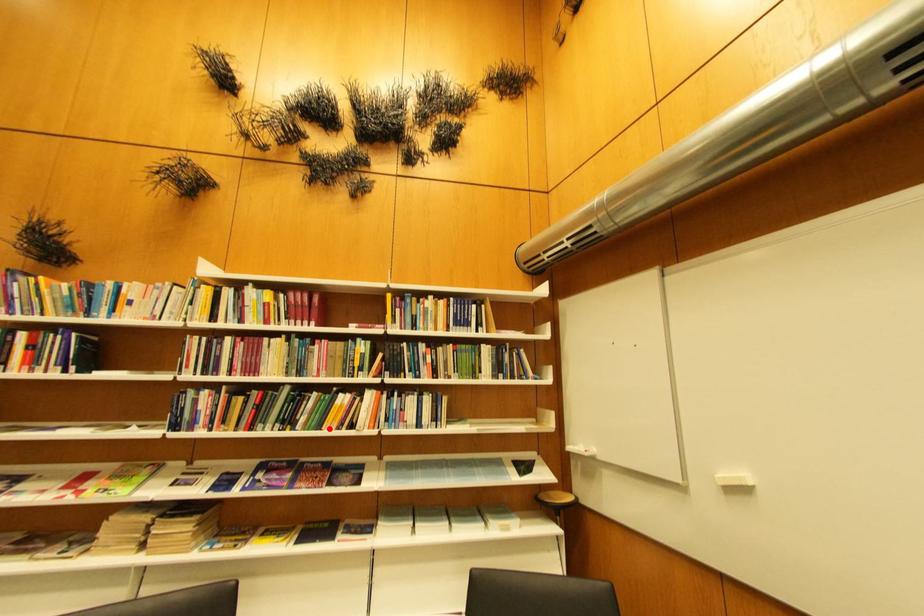
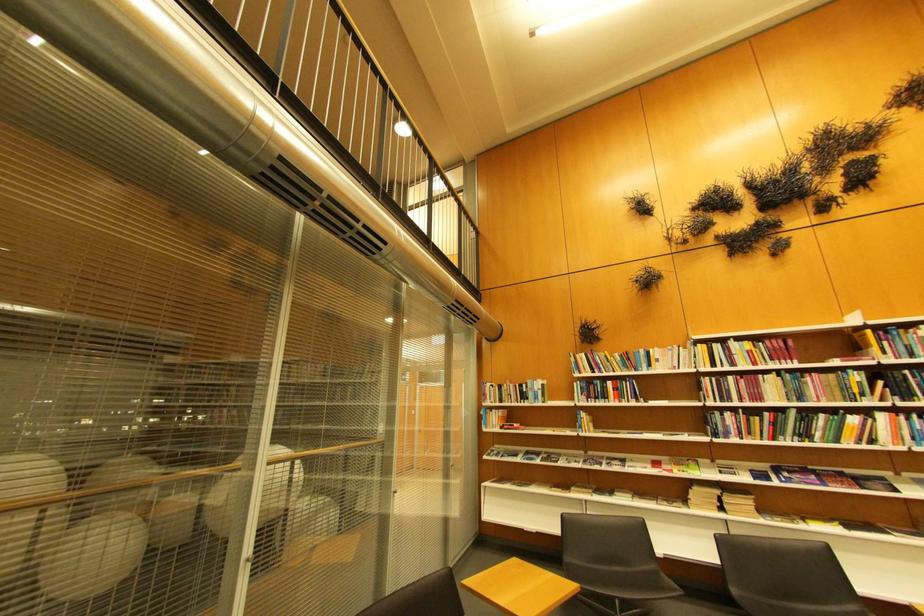
Question: A red point is marked in image1. In image2, is the corresponding 3D point closer to the camera or farther? Reply with the corresponding letter.

Choices:
 (A) The corresponding 3D point is closer.
 (B) The corresponding 3D point is farther.

Answer: (A)